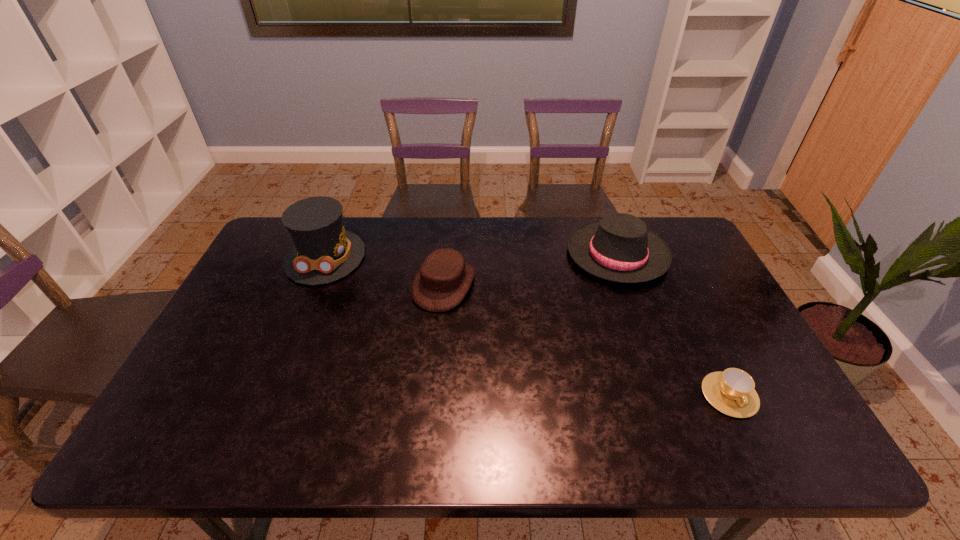
Locate an element on the screen. free space between the shortest hat and the second tallest object is located at coordinates (531, 269).

Locate an element on the screen. Image resolution: width=960 pixels, height=540 pixels. empty location between the rightmost hat and the leftmost object is located at coordinates (471, 256).

Select which object appears as the second closest to the third tallest object. Please provide its 2D coordinates. Your answer should be formatted as a tuple, i.e. [(x, y)], where the tuple contains the x and y coordinates of a point satisfying the conditions above.

[(619, 248)]

Select which object is the closest to the cup. Please provide its 2D coordinates. Your answer should be formatted as a tuple, i.e. [(x, y)], where the tuple contains the x and y coordinates of a point satisfying the conditions above.

[(619, 248)]

The width and height of the screenshot is (960, 540). I want to click on the second closest hat to the shortest object, so click(x=442, y=282).

Identify the location of hat that stands as the second closest to the shortest hat. The height and width of the screenshot is (540, 960). (619, 248).

You are a GUI agent. You are given a task and a screenshot of the screen. Output one action in this format:
    pyautogui.click(x=<x>, y=<y>)
    Task: Click on the free space that satisfies the following two spatial constraints: 1. with goggles on the front of the second hat from right to left; 2. on the left side of the leftmost hat
    
    Given the screenshot: What is the action you would take?
    pyautogui.click(x=314, y=285)